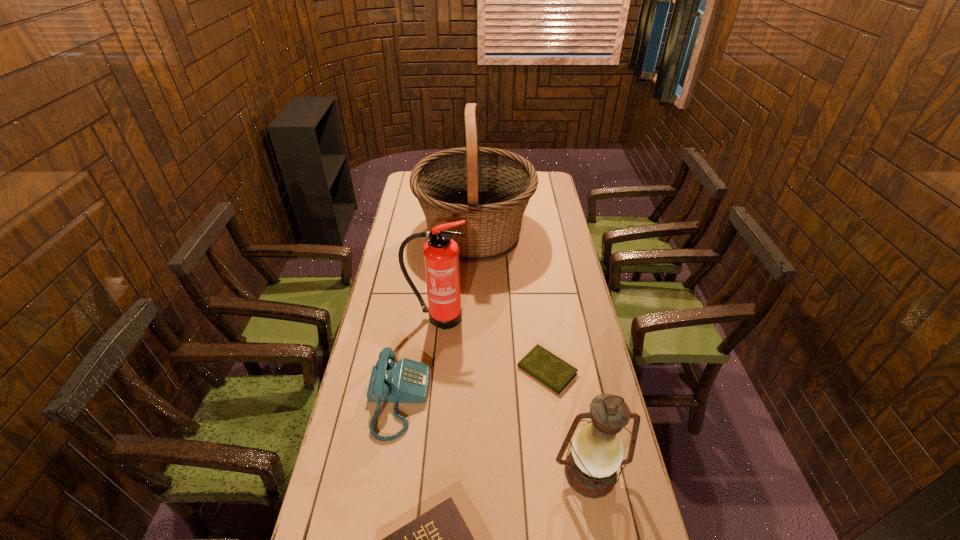
What are the coordinates of `vacant space in between the diary and the farthest object` in the screenshot? It's located at (511, 303).

Where is `free space between the fifth nearest object and the fourth shortest object`? The width and height of the screenshot is (960, 540). free space between the fifth nearest object and the fourth shortest object is located at coordinates (514, 395).

At what (x,y) coordinates should I click in order to perform the action: click on object that is the fifth closest one to the fire extinguisher. Please return your answer as a coordinate pair (x, y). Image resolution: width=960 pixels, height=540 pixels. Looking at the image, I should click on (439, 539).

What are the coordinates of `object that ranks as the fourth closest to the oil lamp` in the screenshot? It's located at (441, 253).

Image resolution: width=960 pixels, height=540 pixels. Find the location of `vacant position in the image that satisfies the following two spatial constraints: 1. at the nozzle of the fifth nearest object; 2. on the dial of the telephone`. vacant position in the image that satisfies the following two spatial constraints: 1. at the nozzle of the fifth nearest object; 2. on the dial of the telephone is located at coordinates (429, 400).

This screenshot has width=960, height=540. What are the coordinates of `vacant position in the image that satisfies the following two spatial constraints: 1. at the nozzle of the second farthest object; 2. on the dial of the telephone` in the screenshot? It's located at pyautogui.click(x=429, y=400).

At what (x,y) coordinates should I click in order to perform the action: click on vacant space that satisfies the following two spatial constraints: 1. on the dial of the telephone; 2. on the back side of the third tallest object. Please return your answer as a coordinate pair (x, y). This screenshot has height=540, width=960. Looking at the image, I should click on (387, 473).

Identify the location of vacant space that satisfies the following two spatial constraints: 1. at the nozzle of the fire extinguisher; 2. on the dial of the third shortest object. (429, 400).